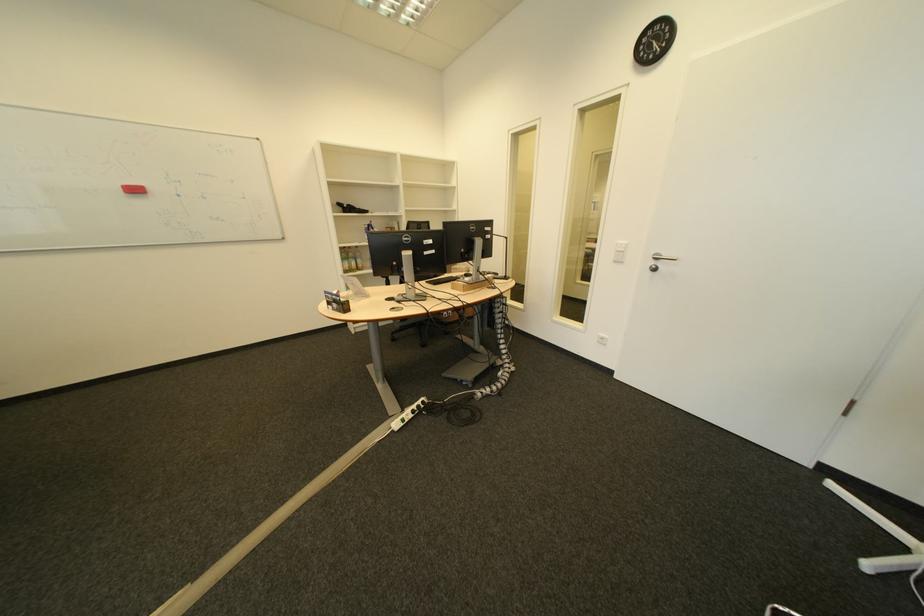
Where would you grasp the red whiteboard eraser? Please return your answer as a coordinate pair (x, y).

(127, 184)